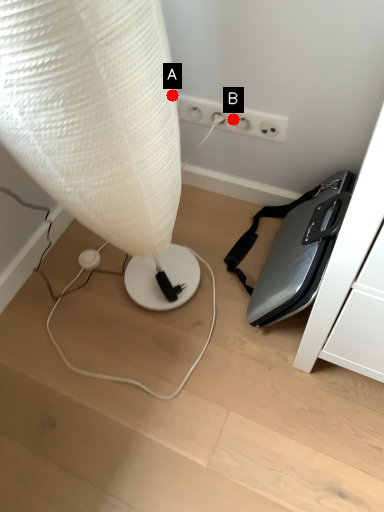
Question: Two points are circled on the image, labeled by A and B beside each circle. Among these points, which one is farthest from the camera?

Choices:
 (A) A is further
 (B) B is further

Answer: (B)